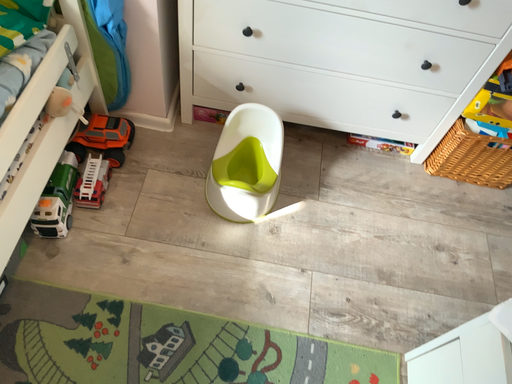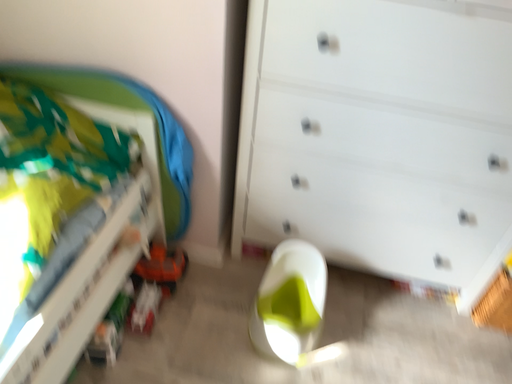
Question: Which way did the camera rotate in the video?

Choices:
 (A) rotated upward
 (B) rotated downward

Answer: (A)